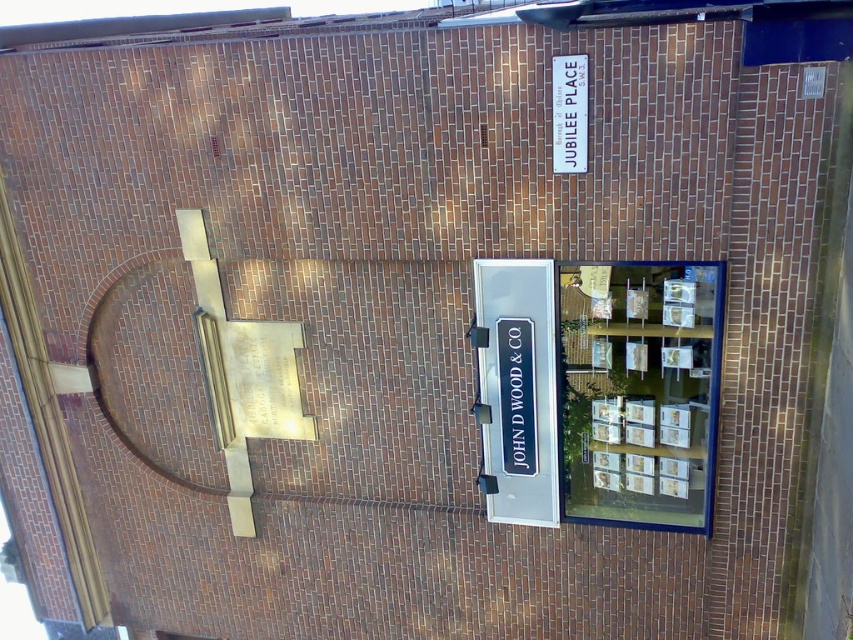
You are standing in front of the brick building at Jubilee Place. There are two points marked on the building wall. The first point is at coordinate (523, 444) and the second is at (576, 134). Which point is closer to you?

Point (523, 444) is closer to you because it is further to the viewer than point (576, 134).